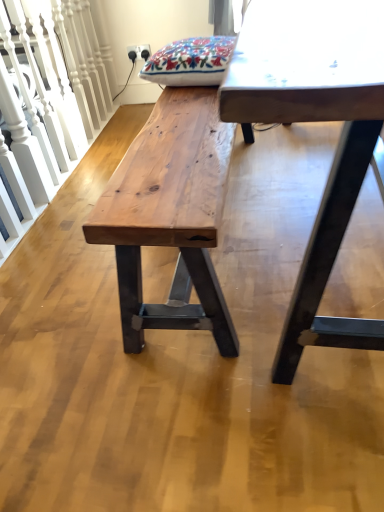
Identify the location of vacant space underneath smooth white table at center (from a real-world perspective). 300,212.